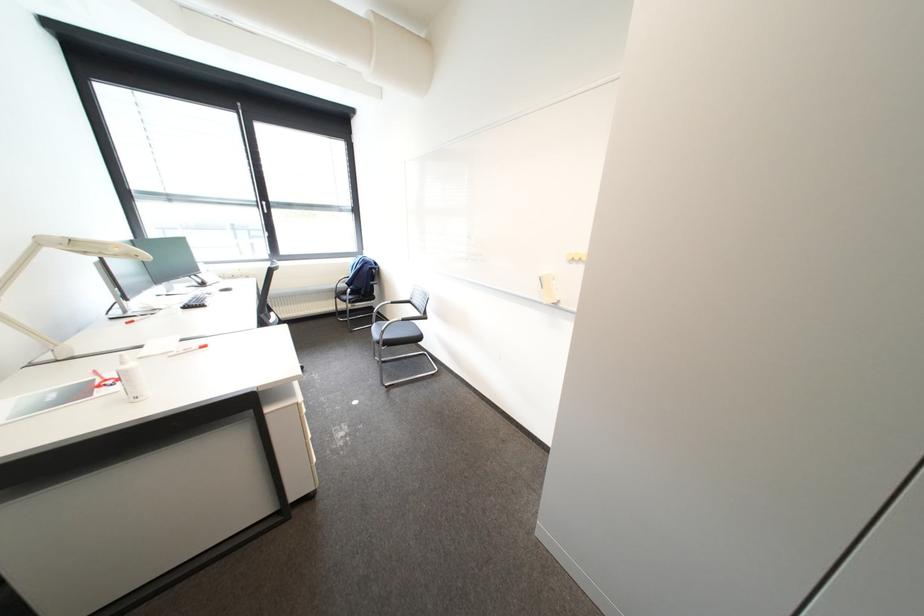
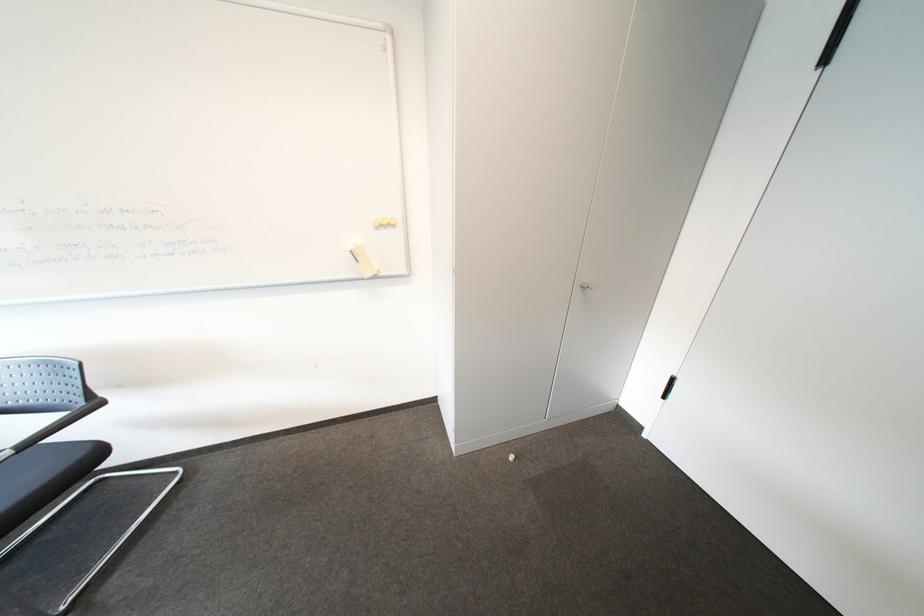
The first image is from the beginning of the video and the second image is from the end. How did the camera likely rotate when shooting the video?

The rotation direction of the camera is right-down.